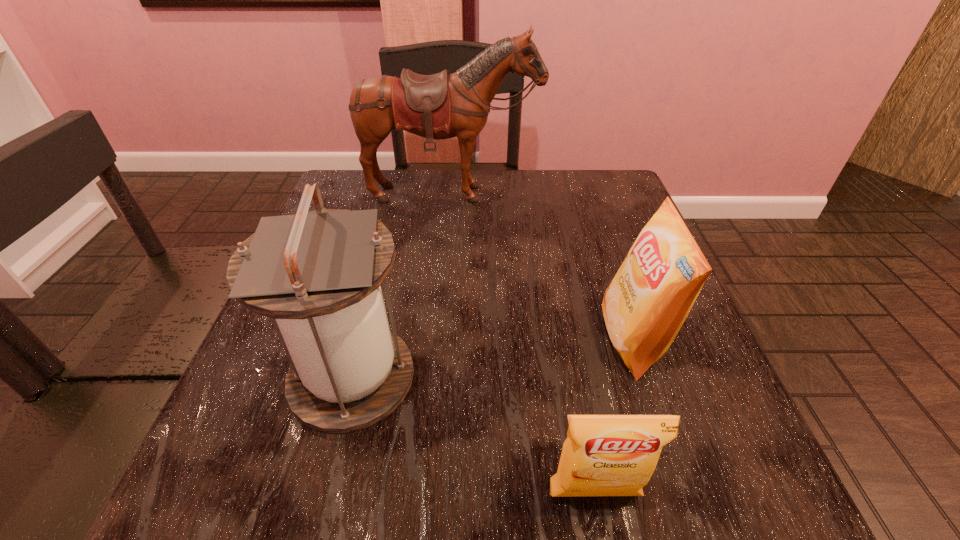
Locate an element on the screen. vacant region at the right edge is located at coordinates (609, 249).

Identify the location of vacant space at the far left corner of the desktop. The width and height of the screenshot is (960, 540). (362, 170).

In the image, there is a desktop. In order to click on vacant space at the far right corner in this screenshot , I will do click(566, 198).

This screenshot has width=960, height=540. In order to click on free space between the lantern and the farthest object in this screenshot , I will do `click(402, 286)`.

Find the location of a particular element. This screenshot has width=960, height=540. free spot between the farthest object and the right crisp (potato chip) is located at coordinates (542, 267).

Identify the location of free point between the farthest object and the right crisp (potato chip). Image resolution: width=960 pixels, height=540 pixels. (542, 267).

The width and height of the screenshot is (960, 540). Identify the location of free space between the farther crisp (potato chip) and the saddle. (542, 267).

Locate an element on the screen. The height and width of the screenshot is (540, 960). vacant region between the lantern and the rightmost object is located at coordinates (492, 359).

The image size is (960, 540). I want to click on free space between the farthest object and the nearest object, so click(x=523, y=344).

Find the location of a particular element. Image resolution: width=960 pixels, height=540 pixels. unoccupied position between the lantern and the left crisp (potato chip) is located at coordinates (473, 436).